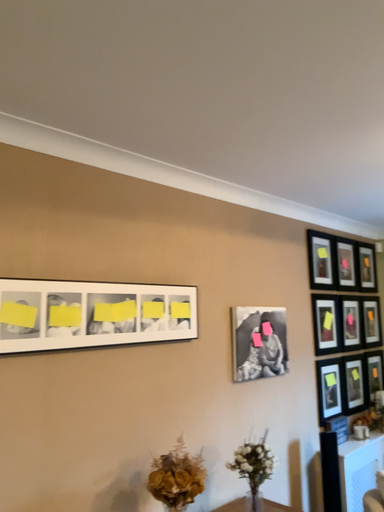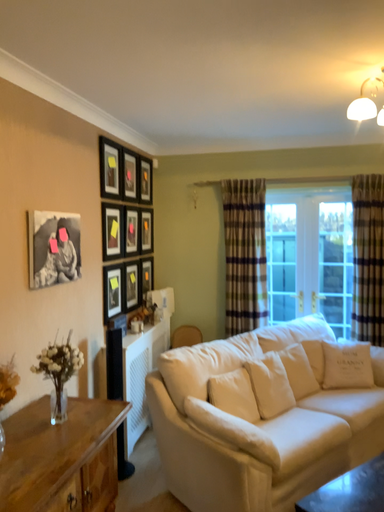
Question: Which way did the camera rotate in the video?

Choices:
 (A) rotated left
 (B) rotated right

Answer: (B)